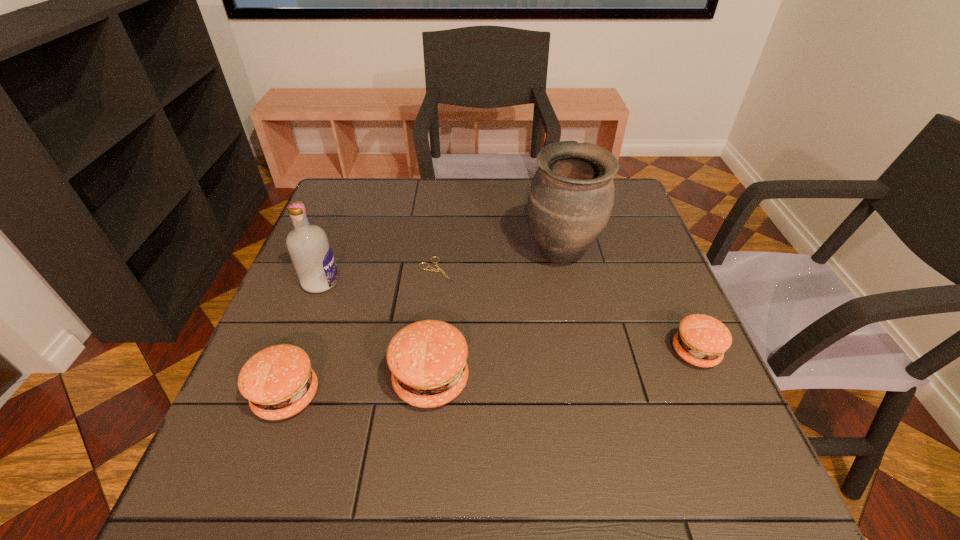
Identify the location of blank space located on the right of the leftmost patty. (346, 396).

The image size is (960, 540). What are the coordinates of `vacant space located 0.110m on the back of the third tallest object` in the screenshot? It's located at (438, 312).

Where is `vacant space situated on the front of the rightmost object`? The width and height of the screenshot is (960, 540). vacant space situated on the front of the rightmost object is located at coordinates (718, 403).

This screenshot has width=960, height=540. I want to click on free space located on the right of the fifth object from left to right, so click(x=618, y=255).

This screenshot has height=540, width=960. Identify the location of blank space located 0.140m on the front of the shears. (431, 328).

Locate an element on the screen. The image size is (960, 540). vacant space located 0.140m on the label of the fifth shortest object is located at coordinates (396, 282).

You are a GUI agent. You are given a task and a screenshot of the screen. Output one action in this format:
    pyautogui.click(x=<x>, y=<y>)
    Task: Click on the patty at the left edge
    The width and height of the screenshot is (960, 540).
    Given the screenshot: What is the action you would take?
    pyautogui.click(x=278, y=381)

Locate an element on the screen. This screenshot has width=960, height=540. vodka that is at the left edge is located at coordinates (309, 248).

You are a GUI agent. You are given a task and a screenshot of the screen. Output one action in this format:
    pyautogui.click(x=<x>, y=<y>)
    Task: Click on the patty situated at the right edge
    
    Given the screenshot: What is the action you would take?
    pyautogui.click(x=701, y=340)

Identify the location of urn present at the right edge. The width and height of the screenshot is (960, 540). (570, 200).